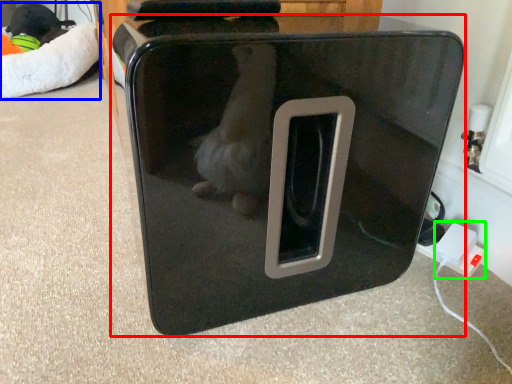
Question: Which object is the farthest from home appliance (highlighted by a red box)? Choose among these: bean bag chair (highlighted by a blue box) or electric outlet (highlighted by a green box).

Choices:
 (A) bean bag chair
 (B) electric outlet

Answer: (A)